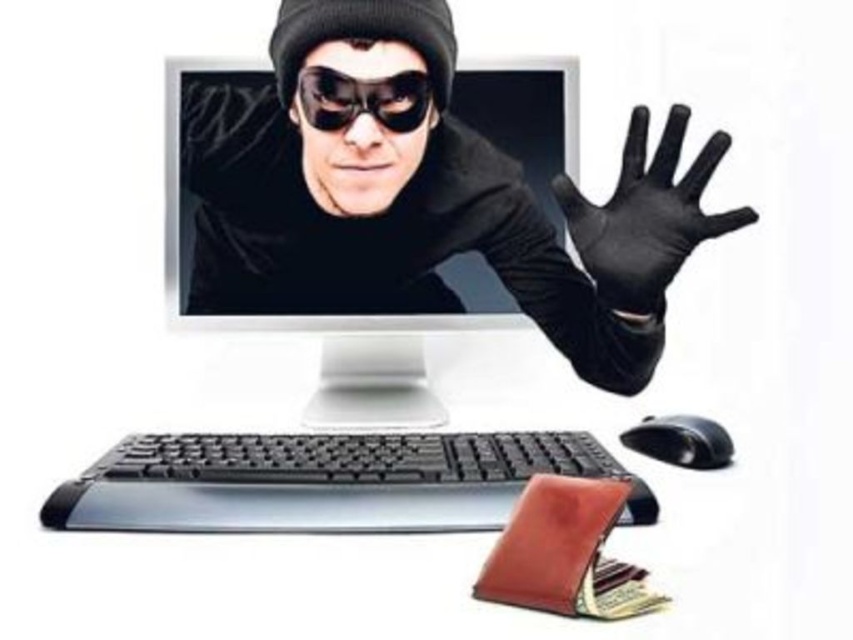
Question: Can you confirm if white glossy computer monitor at center is positioned to the right of black leather glove at right?

Choices:
 (A) no
 (B) yes

Answer: (A)

Question: Among these objects, which one is farthest from the camera?

Choices:
 (A) black plastic mouse at lower right
 (B) black plastic keyboard at lower center
 (C) white glossy computer monitor at center
 (D) black leather glove at right

Answer: (C)

Question: Can you confirm if white glossy computer monitor at center is positioned to the right of black leather glove at right?

Choices:
 (A) no
 (B) yes

Answer: (A)

Question: Does black plastic keyboard at lower center appear on the left side of black leather glove at right?

Choices:
 (A) yes
 (B) no

Answer: (A)

Question: Estimate the real-world distances between objects in this image. Which object is farther from the black plastic mouse at lower right?

Choices:
 (A) black plastic keyboard at lower center
 (B) black leather glove at right

Answer: (A)

Question: Based on their relative distances, which object is nearer to the black plastic keyboard at lower center?

Choices:
 (A) black matte goggles at center
 (B) black leather glove at right
 (C) white glossy computer monitor at center
 (D) black plastic mouse at lower right

Answer: (C)